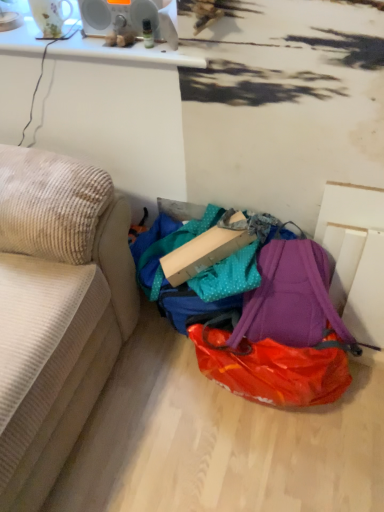
Question: Is beige corduroy couch at left bigger than purple fabric backpack at lower center?

Choices:
 (A) yes
 (B) no

Answer: (A)

Question: Would you say beige corduroy couch at left is outside purple fabric backpack at lower center?

Choices:
 (A) no
 (B) yes

Answer: (B)

Question: Does beige corduroy couch at left have a greater width compared to purple fabric backpack at lower center?

Choices:
 (A) no
 (B) yes

Answer: (B)

Question: Is beige corduroy couch at left further to the viewer compared to purple fabric backpack at lower center?

Choices:
 (A) yes
 (B) no

Answer: (B)

Question: From a real-world perspective, is beige corduroy couch at left on top of purple fabric backpack at lower center?

Choices:
 (A) no
 (B) yes

Answer: (B)

Question: From a real-world perspective, is cardboard box at center positioned above or below purple fabric backpack at lower center?

Choices:
 (A) above
 (B) below

Answer: (A)

Question: From the image's perspective, is cardboard box at center above or below purple fabric backpack at lower center?

Choices:
 (A) above
 (B) below

Answer: (A)

Question: Based on their sizes in the image, would you say cardboard box at center is bigger or smaller than purple fabric backpack at lower center?

Choices:
 (A) big
 (B) small

Answer: (B)

Question: In the image, is cardboard box at center positioned in front of or behind purple fabric backpack at lower center?

Choices:
 (A) front
 (B) behind

Answer: (B)

Question: Looking at their shapes, would you say purple fabric backpack at lower center is wider or thinner than beige corduroy couch at left?

Choices:
 (A) thin
 (B) wide

Answer: (A)

Question: From a real-world perspective, relative to beige corduroy couch at left, is purple fabric backpack at lower center vertically above or below?

Choices:
 (A) above
 (B) below

Answer: (B)

Question: Considering the positions of point (302, 338) and point (23, 346), is point (302, 338) closer or farther from the camera than point (23, 346)?

Choices:
 (A) farther
 (B) closer

Answer: (A)

Question: Considering their positions, is purple fabric backpack at lower center located in front of or behind beige corduroy couch at left?

Choices:
 (A) front
 (B) behind

Answer: (B)

Question: Considering the relative positions of purple fabric backpack at lower center and cardboard box at center in the image provided, is purple fabric backpack at lower center to the left or to the right of cardboard box at center?

Choices:
 (A) left
 (B) right

Answer: (B)

Question: From the image's perspective, is purple fabric backpack at lower center located above or below cardboard box at center?

Choices:
 (A) below
 (B) above

Answer: (A)